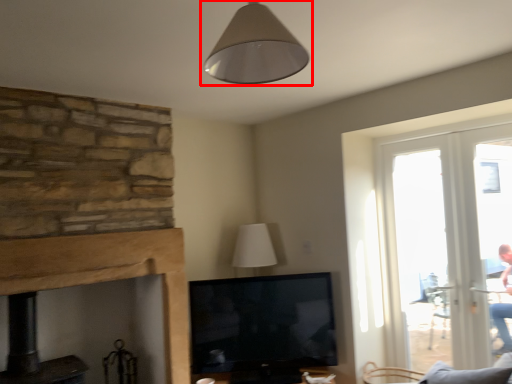
Question: Where is lamp (annotated by the red box) located in relation to fireplace in the image?

Choices:
 (A) left
 (B) right

Answer: (B)